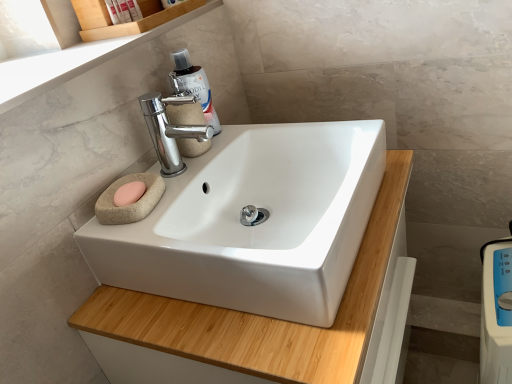
Locate an element on the screen. vacant space situated on the left part of matte plastic soap at upper left, the second toiletry when ordered from right to left is located at coordinates (62, 48).